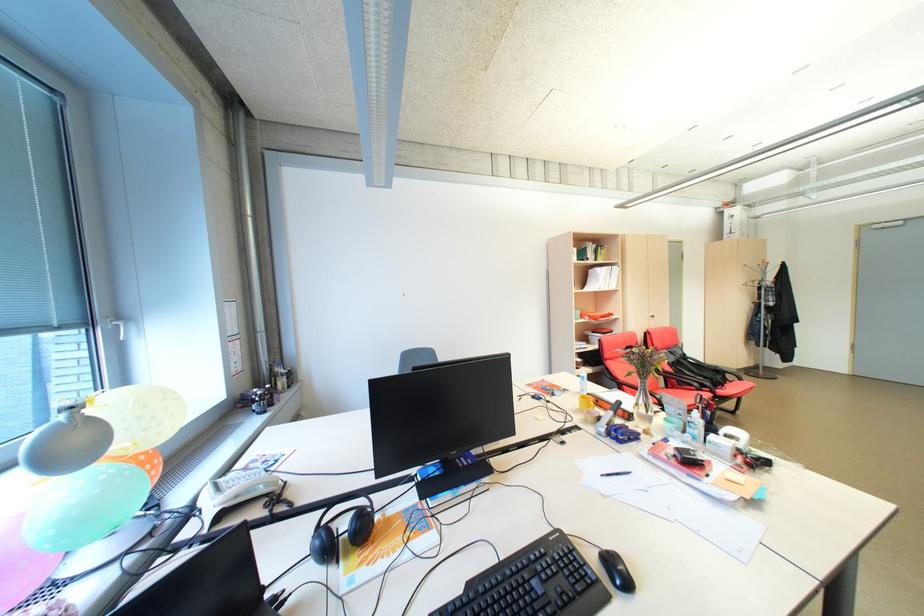
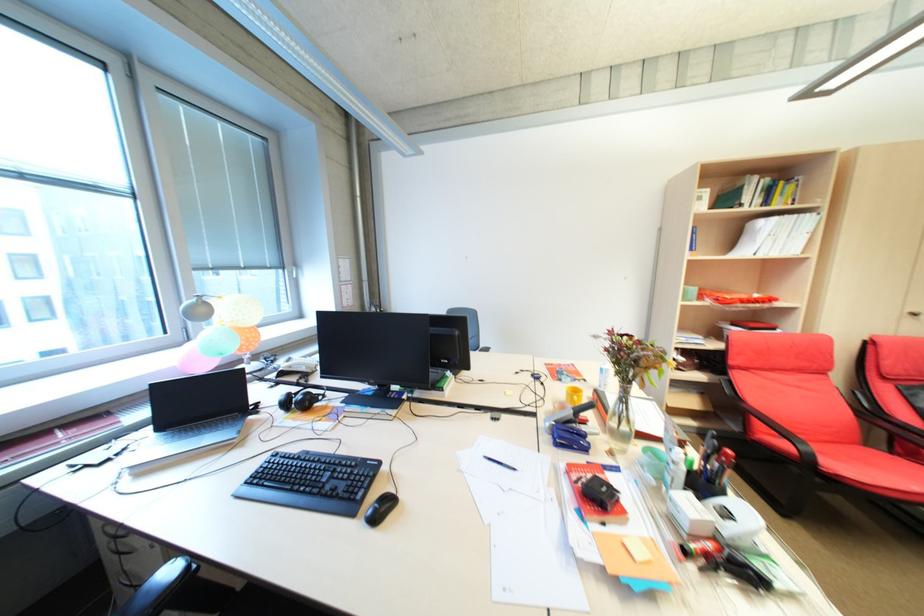
Find the pixel in the second image that matches the point at 611,280 in the first image.

(784, 240)